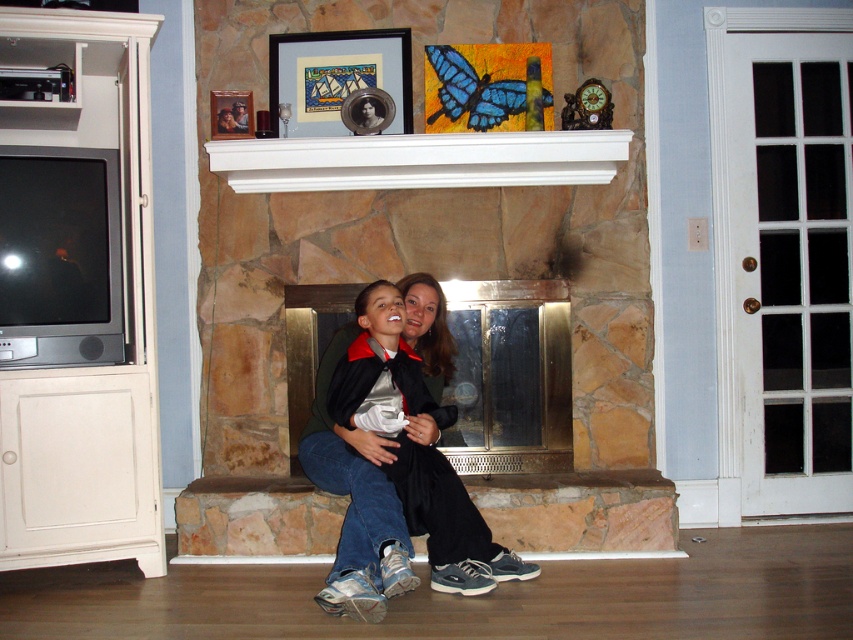
You are standing in front of the fireplace and want to place a small candle on the mantel shelf. The mantel shelf has a width of 1.2 meters. The matte plastic picture frame at upper center is placed at coordinate point (335, 77). If the candle is 0.15 meters in width, will it fit between the left edge of the mantel and the matte plastic picture frame at upper center?

The matte plastic picture frame at upper center is located at point (335, 77) on the mantel shelf. Since the mantel shelf is 1.2 meters wide, the distance from the left edge to the frame is 0.123 meters. The candle is 0.15 meters wide, which is slightly larger than the available space of 0.123 meters. Therefore, the candle will not fit between the left edge and the matte plastic picture frame at upper center.

You are an interior designer planning to hang a large mirror between the stone fireplace at center and the white wood mantle at upper center. Based on their positions, where should the mirror be placed to ensure it hangs centrally between them?

The stone fireplace at center is positioned on the right side of the white wood mantle at upper center, so to hang the mirror centrally between them, it should be placed between the stone fireplace at center and the white wood mantle at upper center, closer to the center point between their positions.